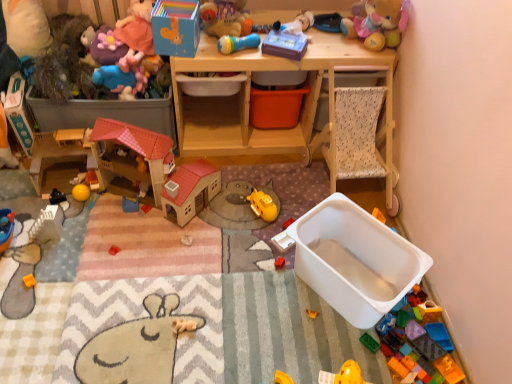
Locate an element on the screen. free space to the back side of white plastic toy at center, arranged as the third toy when viewed from the right is located at coordinates (284, 212).